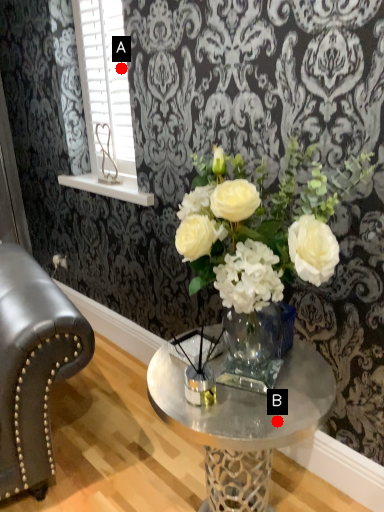
Question: Two points are circled on the image, labeled by A and B beside each circle. Which point is closer to the camera taking this photo?

Choices:
 (A) A is closer
 (B) B is closer

Answer: (B)